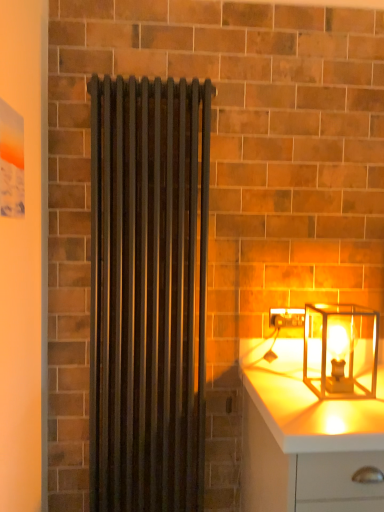
Question: Looking at their shapes, would you say matte black radiator at center is wider or thinner than white glossy chest of drawers at lower right?

Choices:
 (A) thin
 (B) wide

Answer: (A)

Question: From the image's perspective, is matte black radiator at center located above or below white glossy chest of drawers at lower right?

Choices:
 (A) above
 (B) below

Answer: (A)

Question: Based on their relative distances, which object is farther from the matte black radiator at center?

Choices:
 (A) translucent glass lantern at right
 (B) white glossy chest of drawers at lower right

Answer: (A)

Question: Considering the real-world distances, which object is closest to the translucent glass lantern at right?

Choices:
 (A) matte black radiator at center
 (B) white glossy chest of drawers at lower right

Answer: (B)